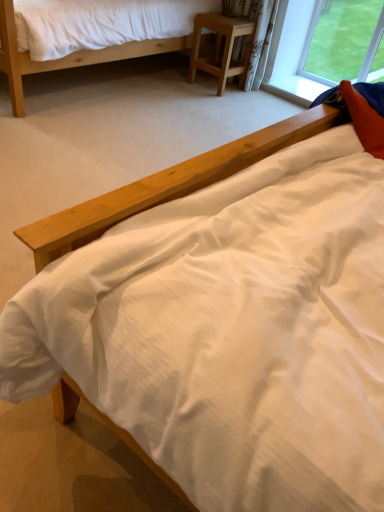
Question: Considering the positions of matte wood bed at upper left and light brown wood at center in the image, is matte wood bed at upper left wider or thinner than light brown wood at center?

Choices:
 (A) thin
 (B) wide

Answer: (B)

Question: Relative to light brown wood at center, is matte wood bed at upper left in front or behind?

Choices:
 (A) front
 (B) behind

Answer: (A)

Question: Considering the positions of matte wood bed at upper left and light brown wood at center in the image, is matte wood bed at upper left taller or shorter than light brown wood at center?

Choices:
 (A) short
 (B) tall

Answer: (B)

Question: Is light brown wood at center inside or outside of matte wood bed at upper left?

Choices:
 (A) outside
 (B) inside

Answer: (A)

Question: Considering the positions of point (205, 68) and point (105, 48), is point (205, 68) closer or farther from the camera than point (105, 48)?

Choices:
 (A) farther
 (B) closer

Answer: (A)

Question: From the image's perspective, is light brown wood at center above or below matte wood bed at upper left?

Choices:
 (A) above
 (B) below

Answer: (B)

Question: Considering the positions of light brown wood at center and matte wood bed at upper left in the image, is light brown wood at center taller or shorter than matte wood bed at upper left?

Choices:
 (A) short
 (B) tall

Answer: (A)